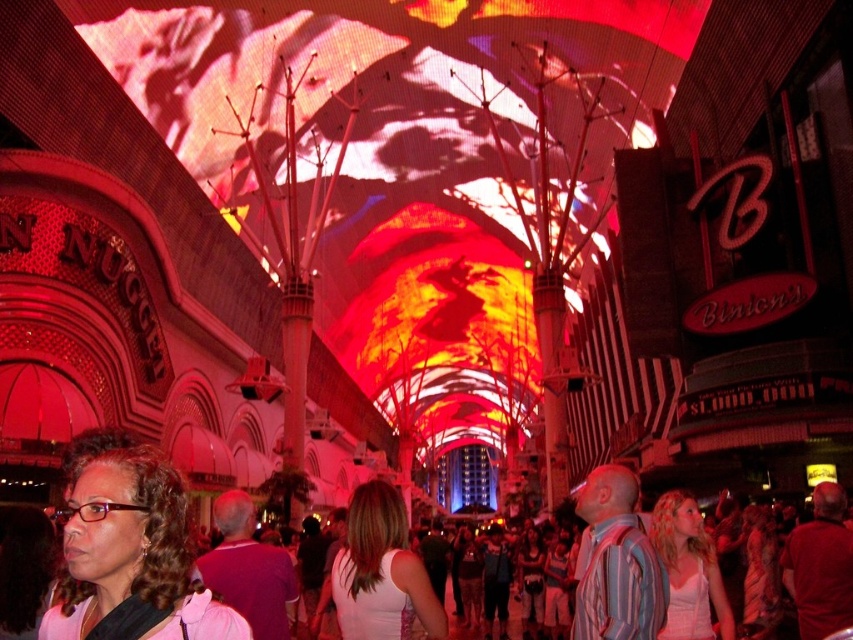
Does white fabric shirt at center have a larger size compared to matte white tank top at center?

Yes.

Does white fabric shirt at center have a smaller size compared to matte white tank top at center?

No.

Describe the element at coordinates (381, 572) in the screenshot. I see `white fabric shirt at center` at that location.

Locate an element on the screen. white fabric shirt at center is located at coordinates (381, 572).

Can you confirm if matte pink shirt at lower left is shorter than matte white tank top at center?

In fact, matte pink shirt at lower left may be taller than matte white tank top at center.

Between point (183, 593) and point (526, 596), which one is positioned behind?

Point (526, 596)

Locate an element on the screen. matte pink shirt at lower left is located at coordinates point(131,552).

Is matte pink shirt at lower left positioned in front of purple matte shirt at center?

Yes, it is in front of purple matte shirt at center.

Where is `matte pink shirt at lower left`? matte pink shirt at lower left is located at coordinates (131, 552).

Between point (177, 627) and point (216, 520), which one is positioned behind?

The point (216, 520) is more distant.

In order to click on matte pink shirt at lower left in this screenshot , I will do `click(131, 552)`.